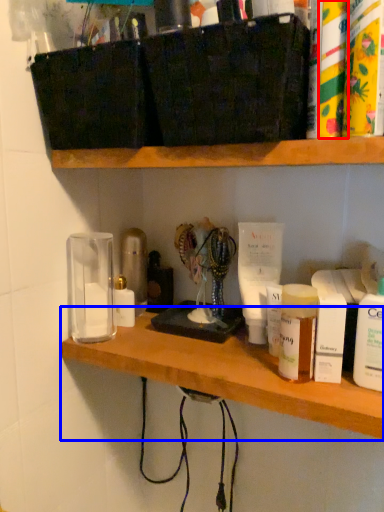
Question: Among these objects, which one is farthest to the camera, toiletry (highlighted by a red box) or shelf (highlighted by a blue box)?

Choices:
 (A) toiletry
 (B) shelf

Answer: (B)